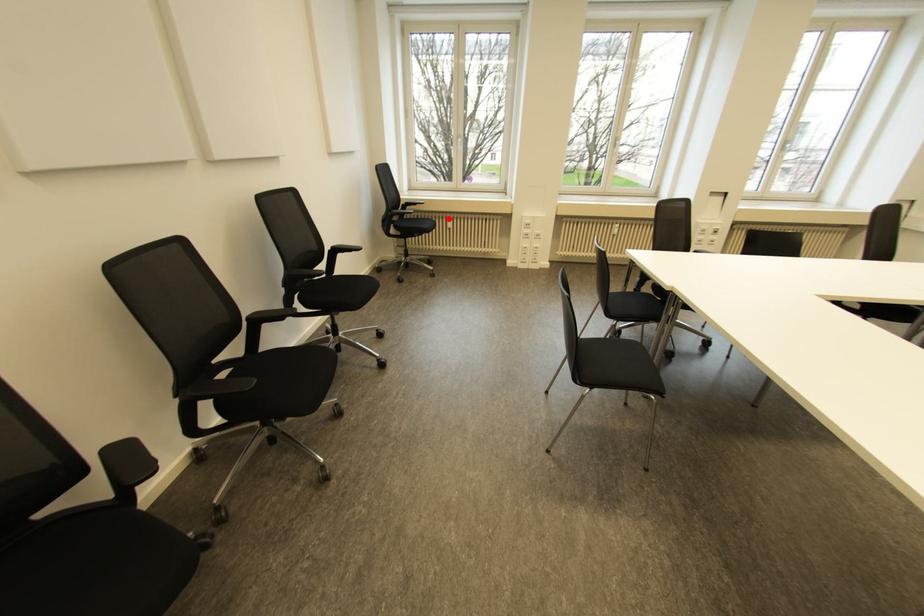
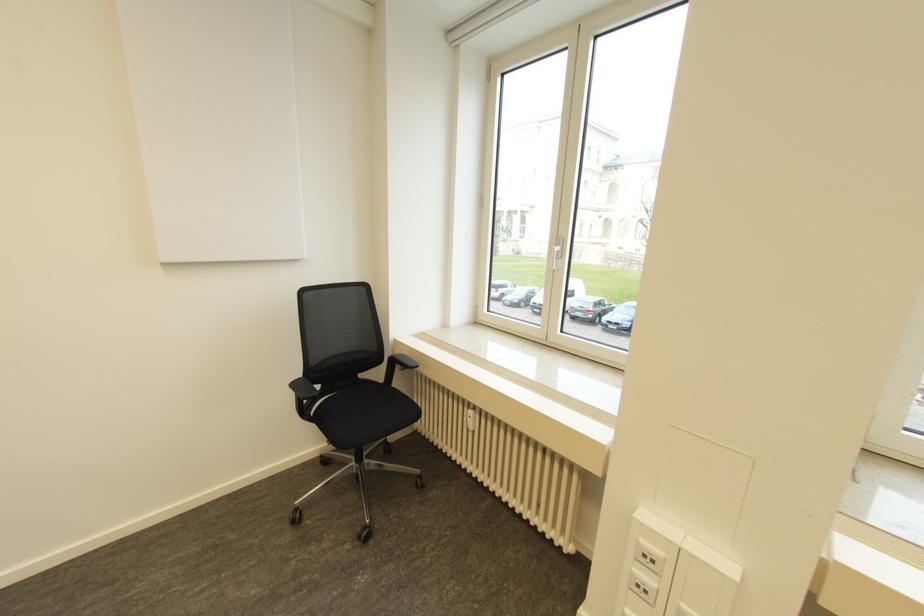
Locate, in the second image, the point that corresponds to the highlighted location in the first image.

(469, 411)